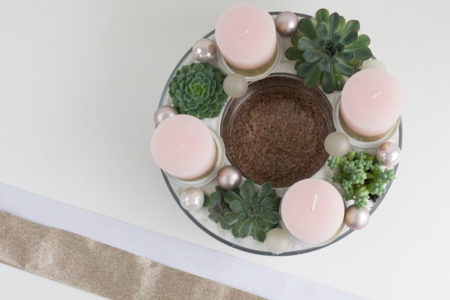
The height and width of the screenshot is (300, 450). Find the location of `candle`. candle is located at coordinates (178, 126), (242, 17), (373, 80), (303, 192).